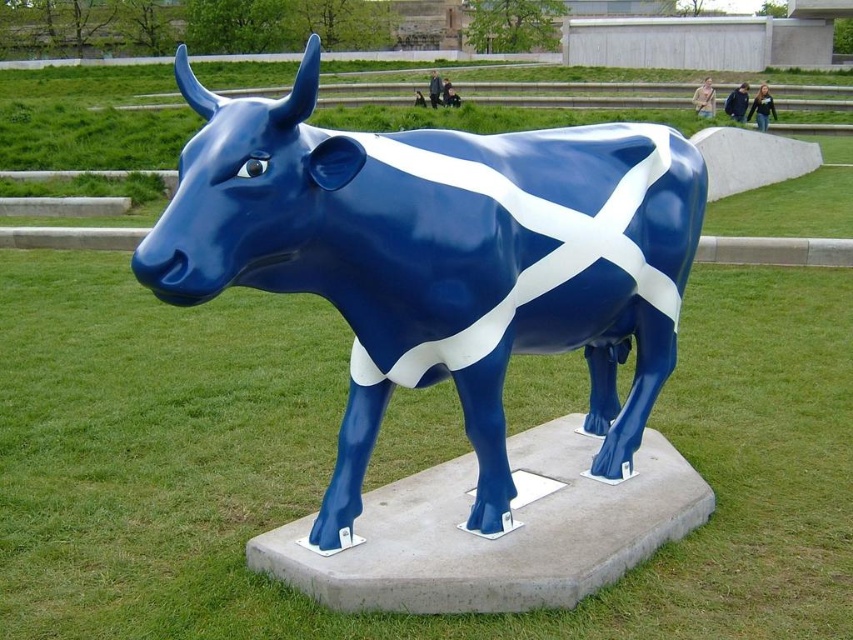
Can you confirm if green grass at center is wider than glossy blue bull at center?

No.

Between green grass at center and glossy blue bull at center, which one has less height?

green grass at center

The image size is (853, 640). Identify the location of green grass at center. (334, 458).

You are a GUI agent. You are given a task and a screenshot of the screen. Output one action in this format:
    pyautogui.click(x=<x>, y=<y>)
    Task: Click on the green grass at center
    
    Given the screenshot: What is the action you would take?
    pyautogui.click(x=334, y=458)